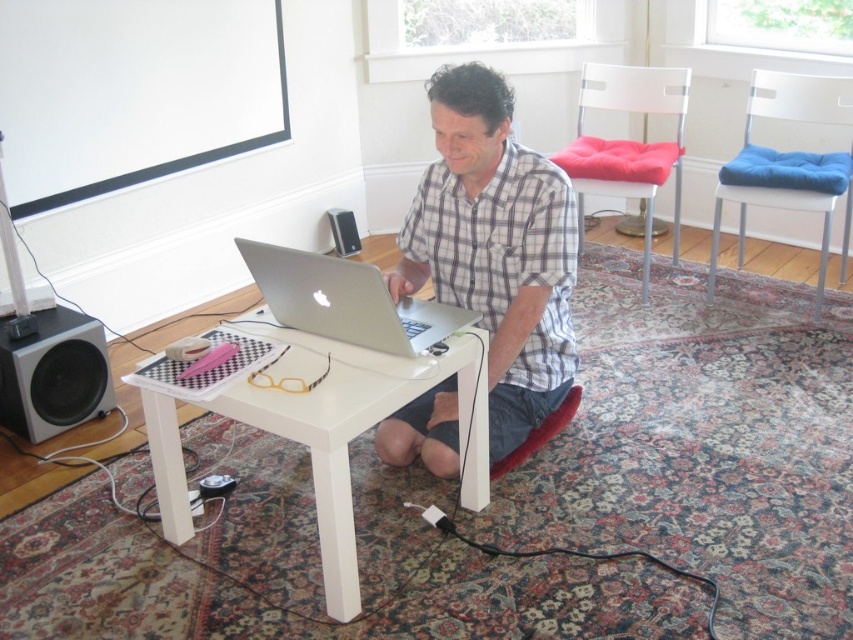
You are organizing a small workspace and need to place both the white glossy table at center and the black matte speaker at lower left. Given their sizes, which object should you place first to ensure they both fit on the shelf?

The white glossy table at center is wider than the black matte speaker at lower left. To ensure both fit on the shelf, place the wider object first, so start with the white glossy table at center.

You are a delivery person entering the room and need to place a package on the nearest speaker to the wall. Which speaker should you choose between the black matte speaker at lower left and the black plastic speaker at lower left?

The black plastic speaker at lower left is further away from the wall, so you should place the package on the black plastic speaker at lower left.

You are a delivery person who needs to place a 12 inch wide package between the white glossy table at center and the black matte speaker at lower left. Is there enough space for the package?

The distance between the white glossy table at center and the black matte speaker at lower left is 34.06 inches. Since the package is 12 inches wide, there is sufficient space to place it between them.